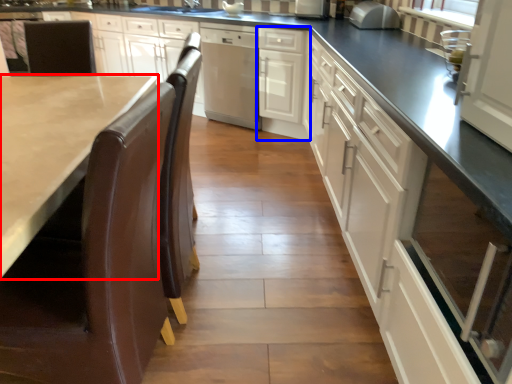
Question: Among these objects, which one is farthest to the camera, countertop (highlighted by a red box) or cabinetry (highlighted by a blue box)?

Choices:
 (A) countertop
 (B) cabinetry

Answer: (B)